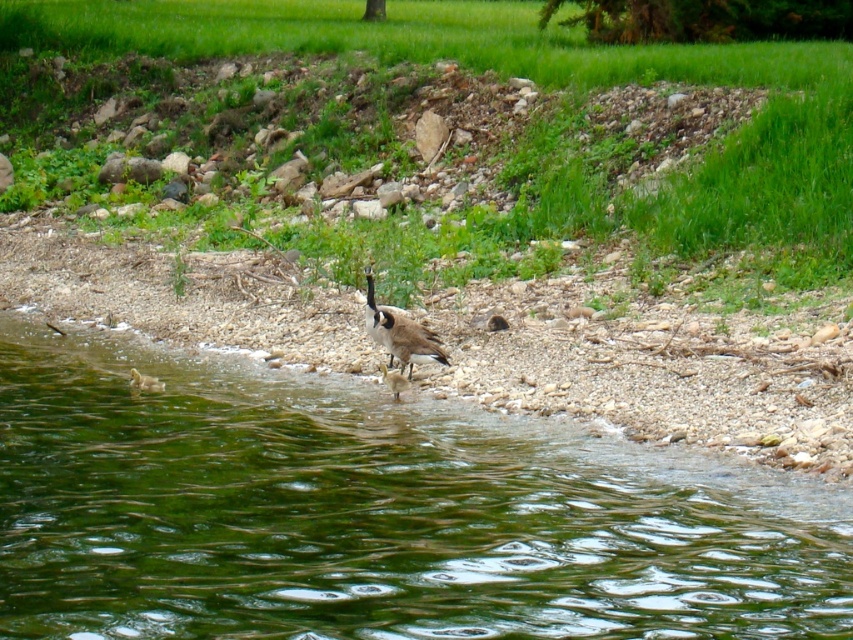
Between point (409, 348) and point (143, 381), which one is positioned behind?

The point (143, 381) is behind.

Consider the image. Measure the distance between brown speckled feathers at center and brown fuzzy duckling at lower left.

brown speckled feathers at center is 6.32 feet from brown fuzzy duckling at lower left.

Who is more distant from viewer, (430, 346) or (146, 384)?

The point (146, 384) is more distant.

What are the coordinates of `brown speckled feathers at center` in the screenshot? It's located at point(408,340).

Is green grass at upper center smaller than brown fuzzy duckling at center?

No.

Is point (273, 44) closer to viewer compared to point (389, 387)?

That is False.

Which is in front, point (808, 168) or point (403, 385)?

Point (403, 385)

Where is `green grass at upper center`? This screenshot has height=640, width=853. green grass at upper center is located at coordinates (538, 83).

Is green smooth water at lower left further to the viewer compared to brown fuzzy duckling at center?

No, it is in front of brown fuzzy duckling at center.

The width and height of the screenshot is (853, 640). What are the coordinates of `green smooth water at lower left` in the screenshot? It's located at (372, 515).